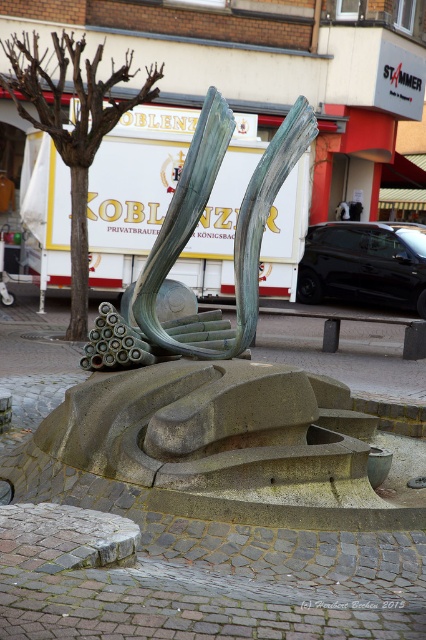
Can you confirm if green patina sculpture at center is positioned below brown/dry wood tree at upper left?

Yes.

Find the location of a particular element. The width and height of the screenshot is (426, 640). green patina sculpture at center is located at coordinates (190, 234).

The image size is (426, 640). I want to click on green patina sculpture at center, so click(190, 234).

You are a GUI agent. You are given a task and a screenshot of the screen. Output one action in this format:
    pyautogui.click(x=<x>, y=<y>)
    Task: Click on the green patina sculpture at center
    Image resolution: width=426 pixels, height=640 pixels.
    Given the screenshot: What is the action you would take?
    pyautogui.click(x=190, y=234)

In the scene shown: Can you confirm if bronze sculpture at center is positioned to the left of brown/dry wood tree at upper left?

No, bronze sculpture at center is not to the left of brown/dry wood tree at upper left.

Is point (187, 205) closer to camera compared to point (152, 72)?

Yes, point (187, 205) is in front of point (152, 72).

Locate an element on the screen. This screenshot has width=426, height=640. bronze sculpture at center is located at coordinates (213, 384).

The width and height of the screenshot is (426, 640). I want to click on bronze sculpture at center, so click(x=213, y=384).

This screenshot has width=426, height=640. Describe the element at coordinates (213, 384) in the screenshot. I see `bronze sculpture at center` at that location.

You are a GUI agent. You are given a task and a screenshot of the screen. Output one action in this format:
    pyautogui.click(x=<x>, y=<y>)
    Task: Click on the bronze sculpture at center
    
    Given the screenshot: What is the action you would take?
    pyautogui.click(x=213, y=384)